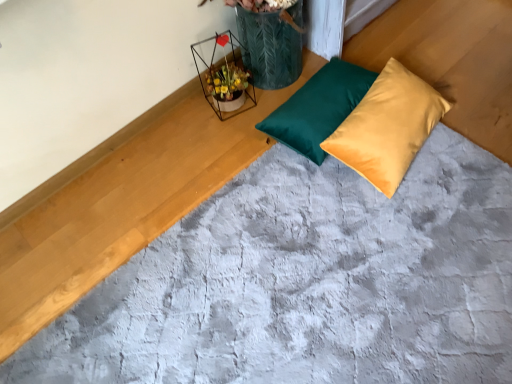
Question: Which is correct: satin yellow pillow at center, the second pillow when ordered from left to right, is inside teal satin pillow at center, marked as the first pillow in a left-to-right arrangement, or outside of it?

Choices:
 (A) outside
 (B) inside

Answer: (A)

Question: In terms of size, does satin yellow pillow at center, the second pillow when ordered from left to right, appear bigger or smaller than teal satin pillow at center, marked as the first pillow in a left-to-right arrangement?

Choices:
 (A) big
 (B) small

Answer: (A)

Question: Which object is the farthest from the teal satin pillow at center, which is the second pillow in right-to-left order?

Choices:
 (A) metallic wire flower basket at upper center
 (B) satin yellow pillow at center, which appears as the 1th pillow when viewed from the right

Answer: (A)

Question: Estimate the real-world distances between objects in this image. Which object is farther from the satin yellow pillow at center, the second pillow when ordered from left to right?

Choices:
 (A) teal satin pillow at center, marked as the first pillow in a left-to-right arrangement
 (B) metallic wire flower basket at upper center

Answer: (B)